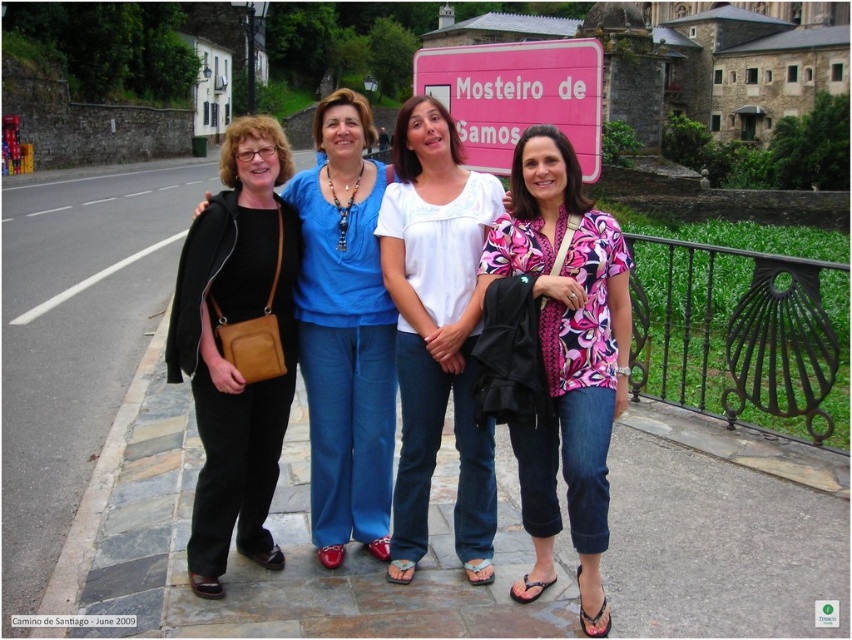
Between pink floral blouse at center and white cotton blouse at center, which one appears on the left side from the viewer's perspective?

From the viewer's perspective, white cotton blouse at center appears more on the left side.

In the scene shown: Who is more distant from viewer, (551,152) or (450,132)?

Positioned behind is point (450,132).

The height and width of the screenshot is (640, 852). Describe the element at coordinates (566, 356) in the screenshot. I see `pink floral blouse at center` at that location.

Find the location of a particular element. This screenshot has width=852, height=640. pink floral blouse at center is located at coordinates [566, 356].

Who is shorter, black leather pants at left or matte black jacket at center?

Standing shorter between the two is black leather pants at left.

Who is more distant from viewer, (246, 516) or (321, 125)?

Positioned behind is point (321, 125).

The image size is (852, 640). Identify the location of black leather pants at left. (223, 355).

Can you confirm if pink floral blouse at center is positioned above black leather pants at left?

Yes, pink floral blouse at center is above black leather pants at left.

Who is more distant from viewer, (537, 580) or (269, 138)?

The point (269, 138) is more distant.

Which is behind, point (573, 524) or point (217, 476)?

The point (217, 476) is behind.

Locate an element on the screen. pink floral blouse at center is located at coordinates (566, 356).